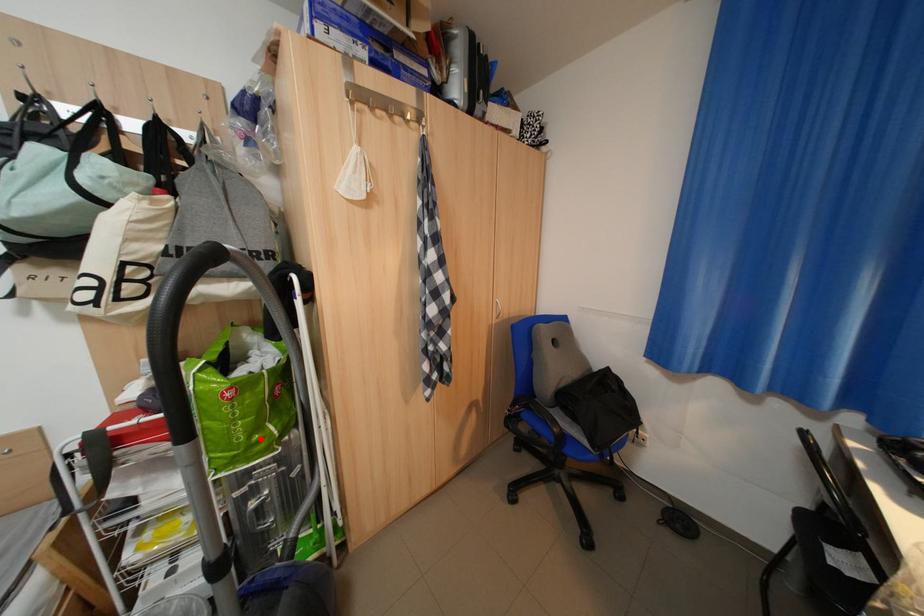
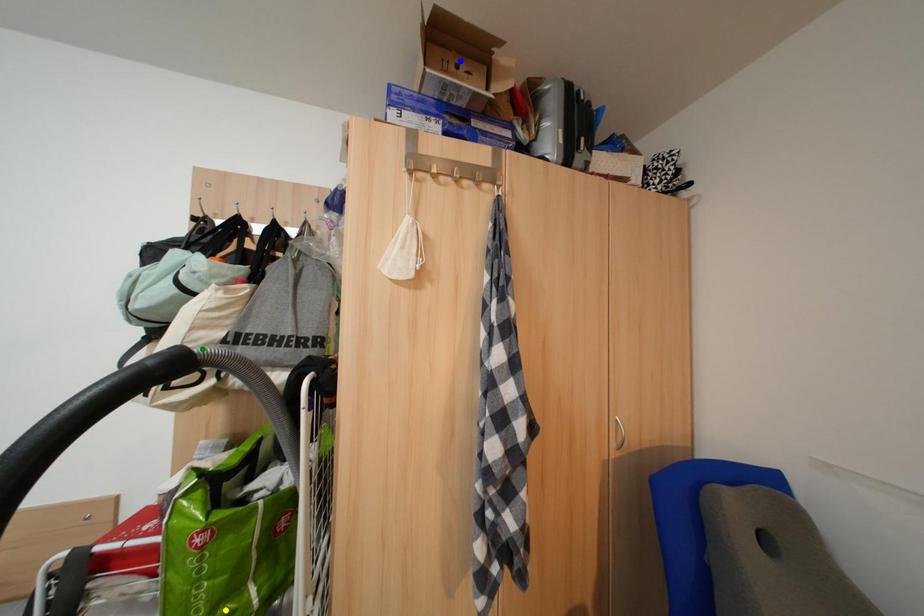
Question: I am providing you with two images of the same scene from different viewpoints. A red point is marked on the first image. You are given multiple points on the second image. Which point in image 2 is actually the same real-world point as the red point in image 1?

Choices:
 (A) green point
 (B) yellow point
 (C) blue point

Answer: (B)